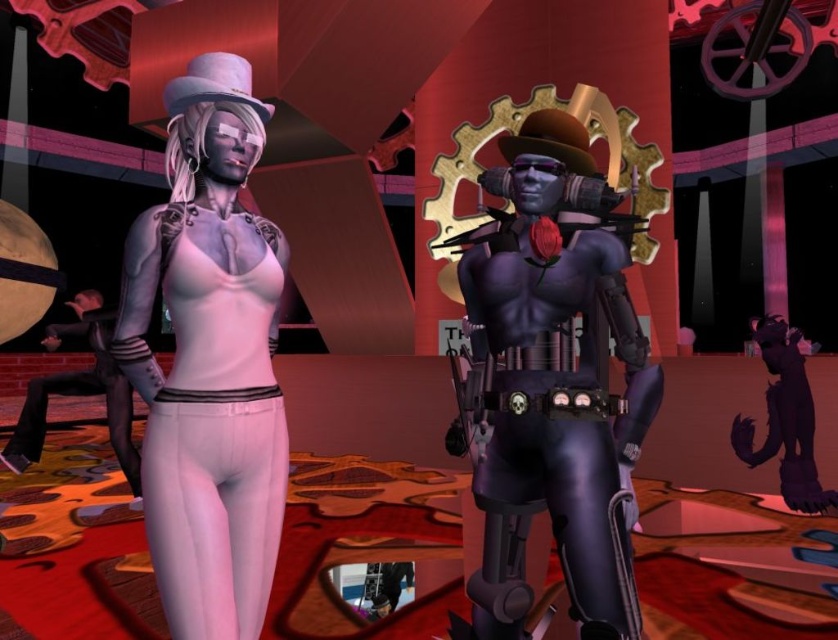
Is matte white skin at left to the left of matte black leather pants at left from the viewer's perspective?

In fact, matte white skin at left is to the right of matte black leather pants at left.

Identify the location of matte white skin at left. point(210,360).

Find the location of `matte white skin at left`. matte white skin at left is located at coordinates (210, 360).

Who is more distant from viewer, [593,410] or [226,156]?

The point [593,410] is more distant.

Who is shorter, shiny purple armor at center or matte white skin at left?

With less height is matte white skin at left.

Is point (480, 609) more distant than point (154, 268)?

Yes, point (480, 609) is farther from viewer.

Where is `shiny purple armor at center`? The image size is (838, 640). shiny purple armor at center is located at coordinates coord(552,381).

Is the position of shiny purple armor at center less distant than that of matte black leather pants at left?

Yes, it is in front of matte black leather pants at left.

Does shiny purple armor at center have a smaller size compared to matte black leather pants at left?

Actually, shiny purple armor at center might be larger than matte black leather pants at left.

You are a GUI agent. You are given a task and a screenshot of the screen. Output one action in this format:
    pyautogui.click(x=<x>, y=<y>)
    Task: Click on the shiny purple armor at center
    The width and height of the screenshot is (838, 640).
    Given the screenshot: What is the action you would take?
    pyautogui.click(x=552, y=381)